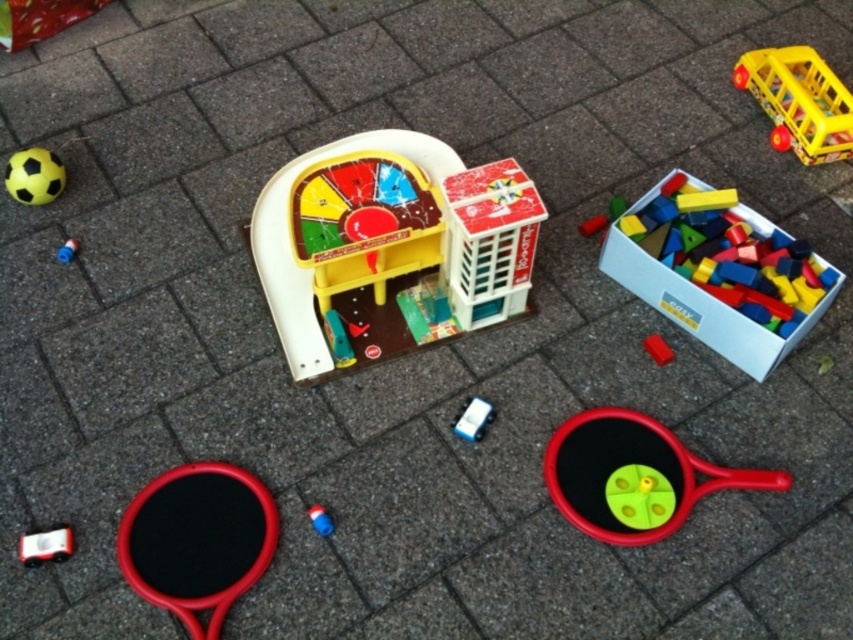
Question: Considering the real-world distances, which object is closest to the rubberized red tennis racket at lower center?

Choices:
 (A) yellow matte soccer ball at upper left
 (B) blue plastic toy at center-left

Answer: (B)

Question: From the image, what is the correct spatial relationship of rubberized red tennis racket at lower center in relation to wooden toy blocks at upper right?

Choices:
 (A) below
 (B) above

Answer: (A)

Question: Is rubberized red tennis racket at center to the right of wooden toy blocks at upper right from the viewer's perspective?

Choices:
 (A) no
 (B) yes

Answer: (A)

Question: Which point is farther to the camera?

Choices:
 (A) rubberized red tennis racket at lower center
 (B) matte plastic toy at center
 (C) blue rubber toy at center

Answer: (C)

Question: Does white plastic phone at center appear under blue rubber toy at center?

Choices:
 (A) no
 (B) yes

Answer: (A)

Question: Which of the following is the closest to the observer?

Choices:
 (A) [695, 460]
 (B) [241, 554]
 (C) [770, 337]
 (D) [70, 253]

Answer: (B)